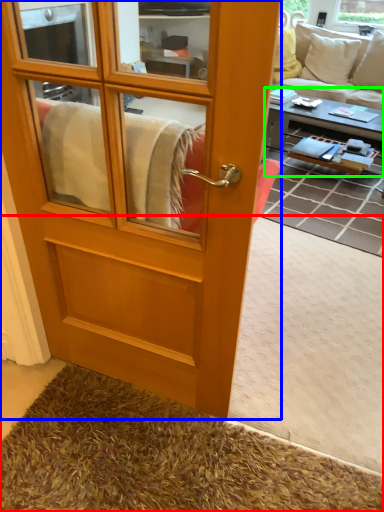
Question: Which object is the closest to the carpets (highlighted by a red box)? Choose among these: screen door (highlighted by a blue box) or coffee table (highlighted by a green box).

Choices:
 (A) screen door
 (B) coffee table

Answer: (A)